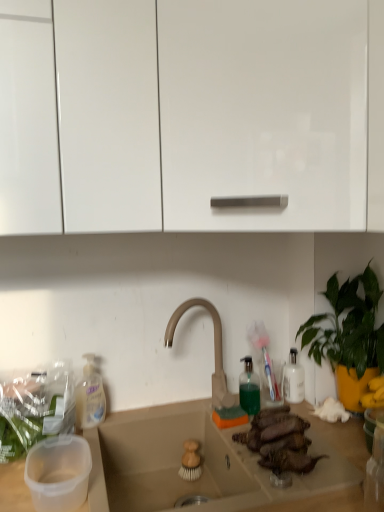
The width and height of the screenshot is (384, 512). I want to click on vacant area that is in front of green translucent bottle at center-right, arranged as the second bottle when viewed from the left, so click(x=256, y=454).